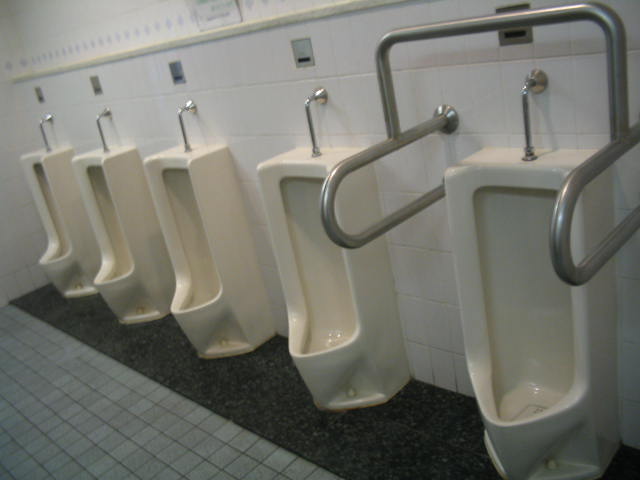
I want to click on urinal, so click(48, 183), click(109, 192), click(203, 194), click(310, 222), click(506, 245).